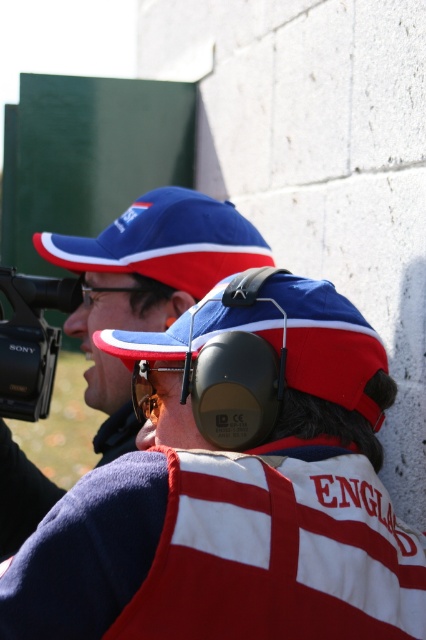
From the picture: Which is above, matte blue cap at upper center or black plastic camera at left?

black plastic camera at left

Is point (141, 282) farther from camera compared to point (14, 385)?

No, it is not.

The image size is (426, 640). Find the location of `matte blue cap at upper center`. matte blue cap at upper center is located at coordinates point(146,284).

Between point (317, 544) and point (221, 276), which one is positioned in front?

Point (317, 544) is more forward.

Between point (252, 570) and point (176, 198), which one is positioned behind?

Positioned behind is point (176, 198).

Which is behind, point (290, 342) or point (195, 253)?

The point (195, 253) is more distant.

This screenshot has height=640, width=426. Identify the location of matte black ear protection at center. (235, 497).

Which is below, matte black ear protection at center or matte blue cap at upper center?

matte black ear protection at center is below.

Does matte black ear protection at center have a smaller size compared to matte blue cap at upper center?

Correct, matte black ear protection at center occupies less space than matte blue cap at upper center.

Which is behind, point (393, 572) or point (118, 321)?

Point (118, 321)

Find the location of a particular element. matte black ear protection at center is located at coordinates (235, 497).